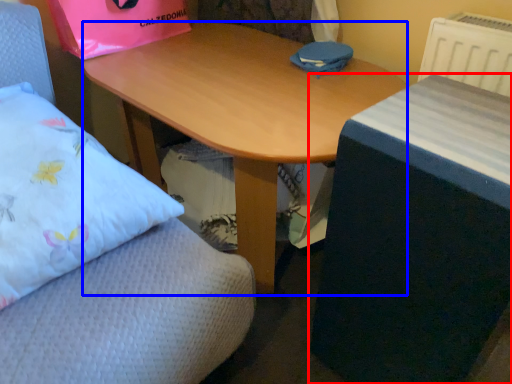
Question: Which point is further to the camera, table (highlighted by a red box) or desk (highlighted by a blue box)?

Choices:
 (A) table
 (B) desk

Answer: (B)